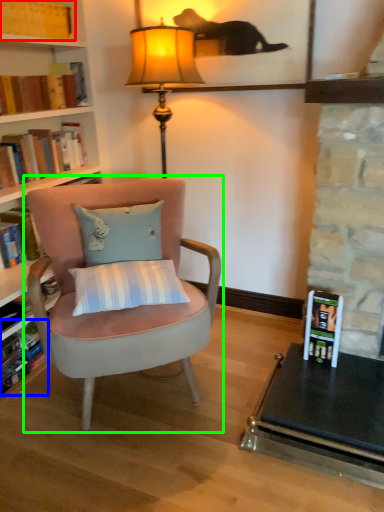
Question: Based on their relative distances, which object is nearer to book (highlighted by a red box)? Choose from book (highlighted by a blue box) and chair (highlighted by a green box).

Choices:
 (A) book
 (B) chair

Answer: (B)